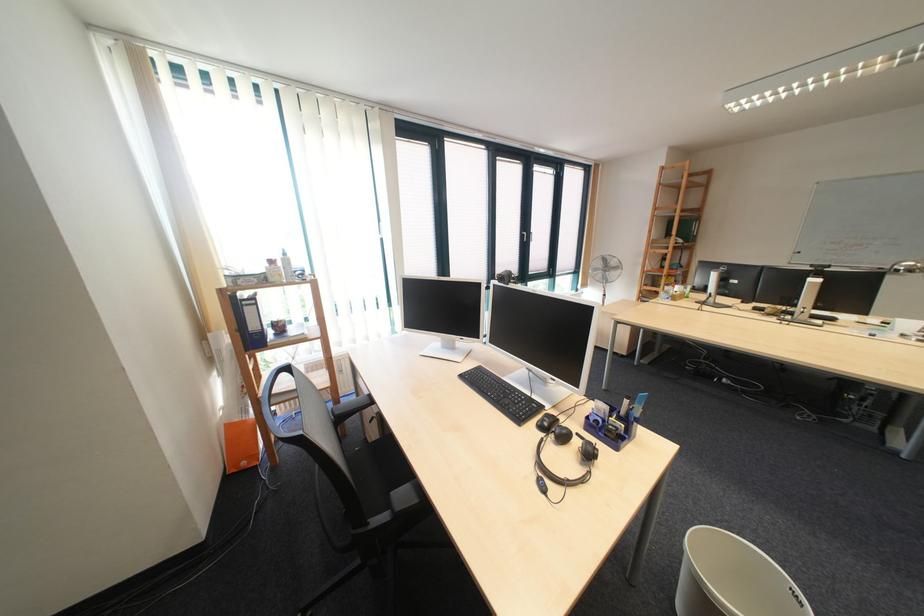
Describe the element at coordinates (387, 461) in the screenshot. This screenshot has width=924, height=616. I see `the chair sitting surface` at that location.